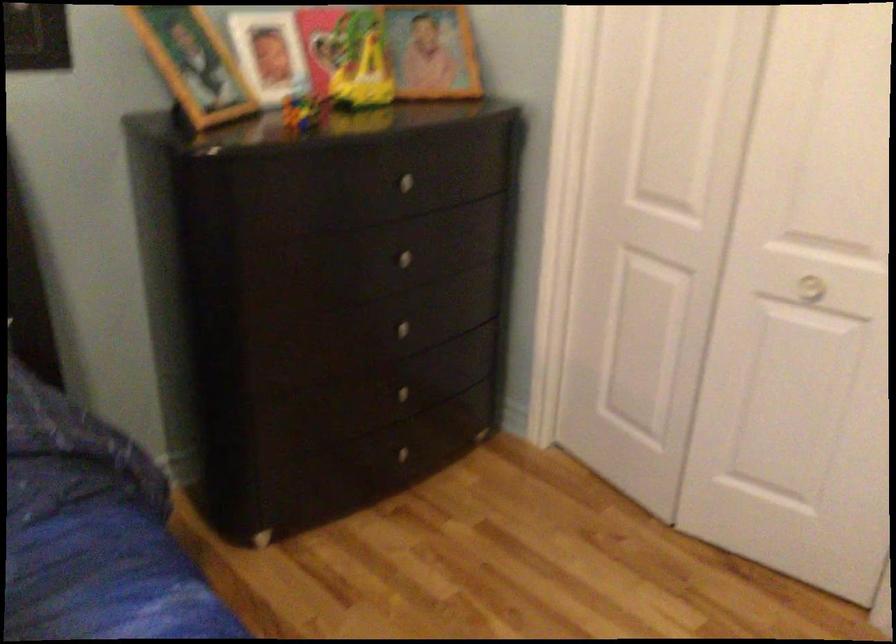
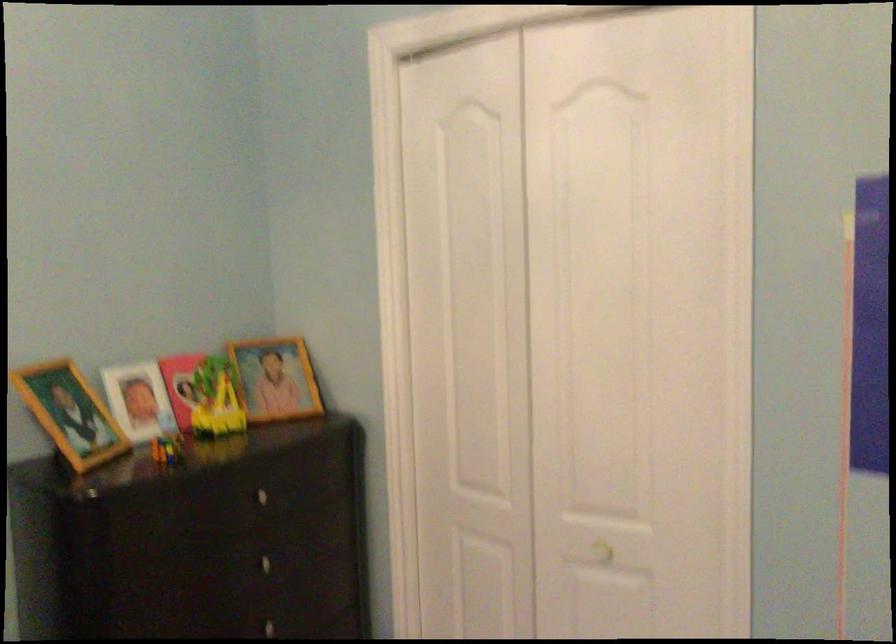
Question: In a continuous first-person perspective shot, in which direction is the camera moving?

Choices:
 (A) Left
 (B) Right
 (C) Forward
 (D) Backward

Answer: (D)